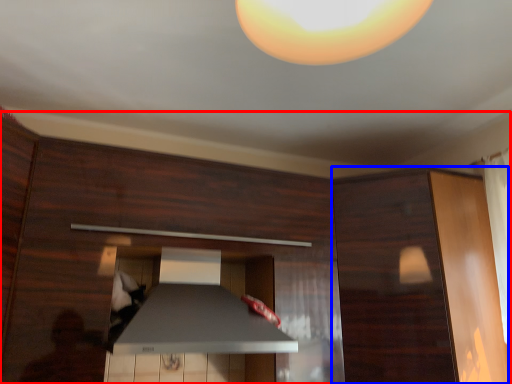
Question: Which point is closer to the camera, dresser (highlighted by a red box) or cabinetry (highlighted by a blue box)?

Choices:
 (A) dresser
 (B) cabinetry

Answer: (A)